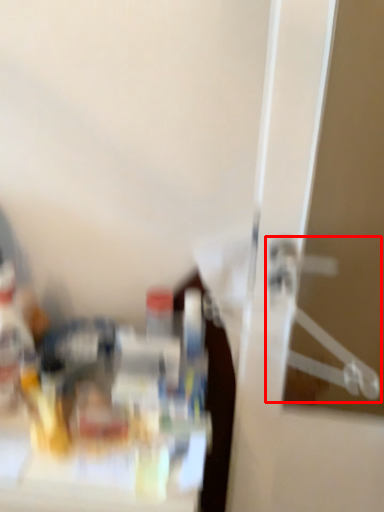
Question: From the image's perspective, what is the correct spatial positioning of hanger (annotated by the red box) in reference to bottle?

Choices:
 (A) below
 (B) above

Answer: (B)